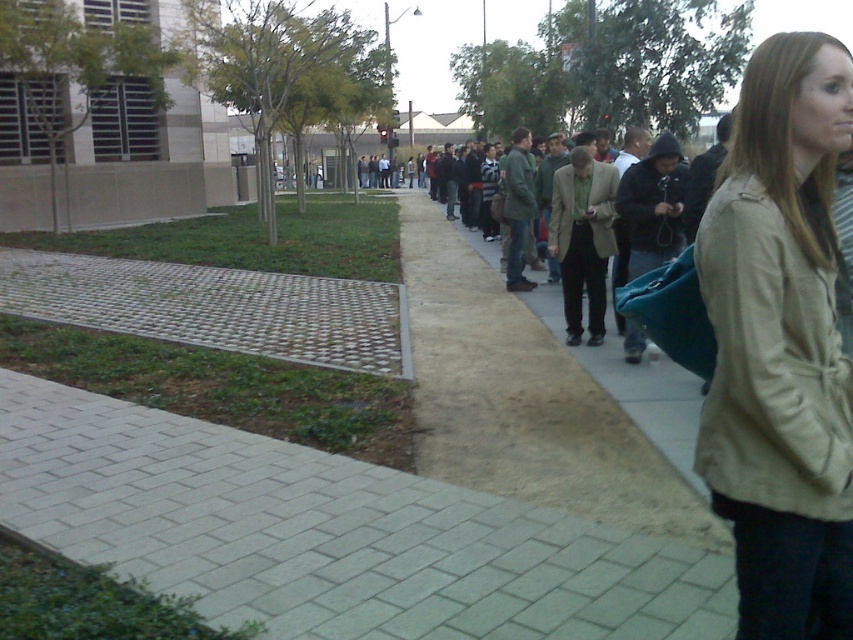
You are a pedestrian standing at the edge of the gray brick pavement at lower left. You want to walk towards the matte brown jacket at center. Which direction should you move to reach it?

To reach the matte brown jacket at center from the gray brick pavement at lower left, you should move upwards since the gray brick pavement at lower left is below the matte brown jacket at center.

You are a person trying to decide which jacket to wear today. You have a beige fabric jacket at center and a matte brown jacket at center. Which one would you choose if you want a larger jacket?

The beige fabric jacket at center is bigger than the matte brown jacket at center, so you should choose the beige fabric jacket at center.